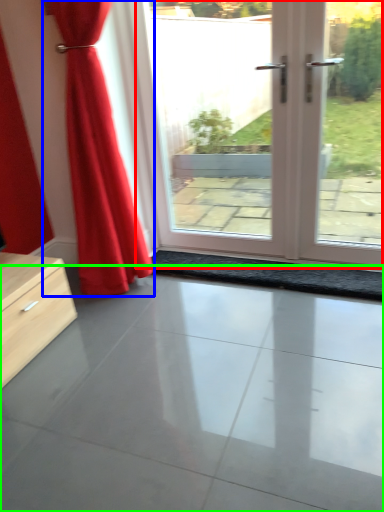
Question: Which object is the farthest from door (highlighted by a red box)? Choose among these: curtain (highlighted by a blue box) or concrete (highlighted by a green box).

Choices:
 (A) curtain
 (B) concrete

Answer: (B)